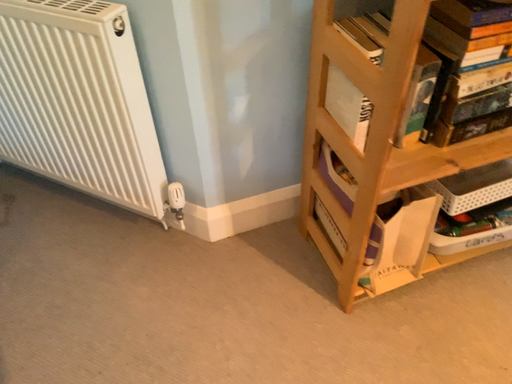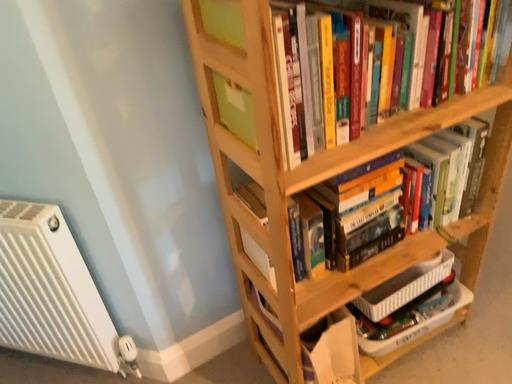
Question: How did the camera likely rotate when shooting the video?

Choices:
 (A) rotated upward
 (B) rotated downward

Answer: (A)